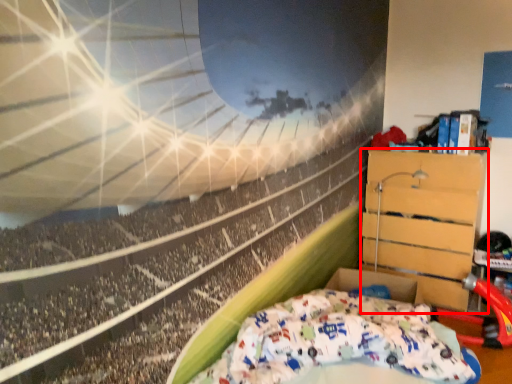
Question: Considering the relative positions of furniture (annotated by the red box) and bed in the image provided, where is furniture (annotated by the red box) located with respect to the staircase?

Choices:
 (A) right
 (B) left

Answer: (A)